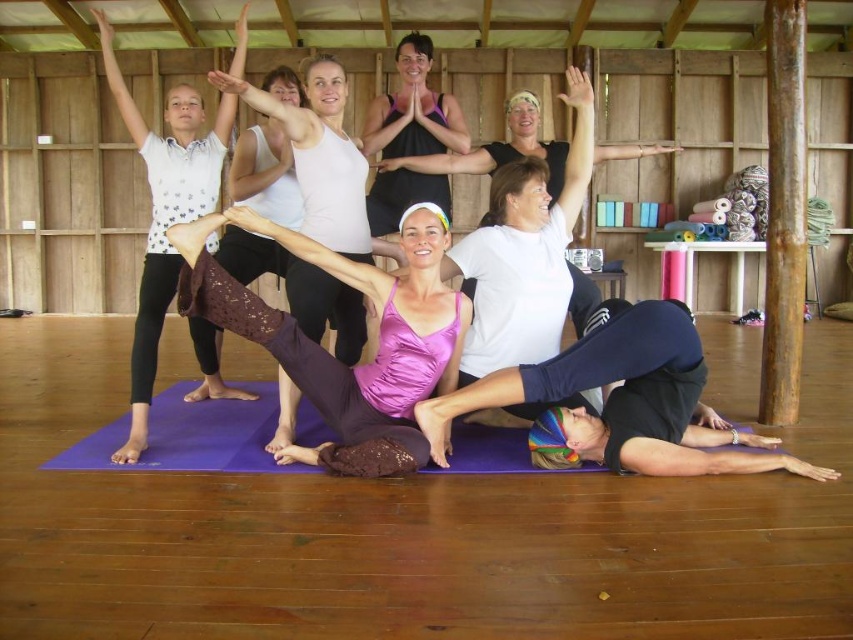
You are a photographer taking a picture of the yoga session. You need to ensure that the white dotted tank top at upper left and the purple lace leggings at center are both visible in the frame. Which clothing item should you focus on to ensure both are in focus, considering their sizes?

The white dotted tank top at upper left is larger in size compared to the purple lace leggings at center. To ensure both are in focus, you should focus on the larger white dotted tank top at upper left since it requires more attention due to its size.

You are a photographer taking a group photo of the yoga session. You notice the white dotted tank top at upper left and the purple lace leggings at center. Which clothing item appears larger in the photo?

The white dotted tank top at upper left appears larger than the purple lace leggings at center in the photo.